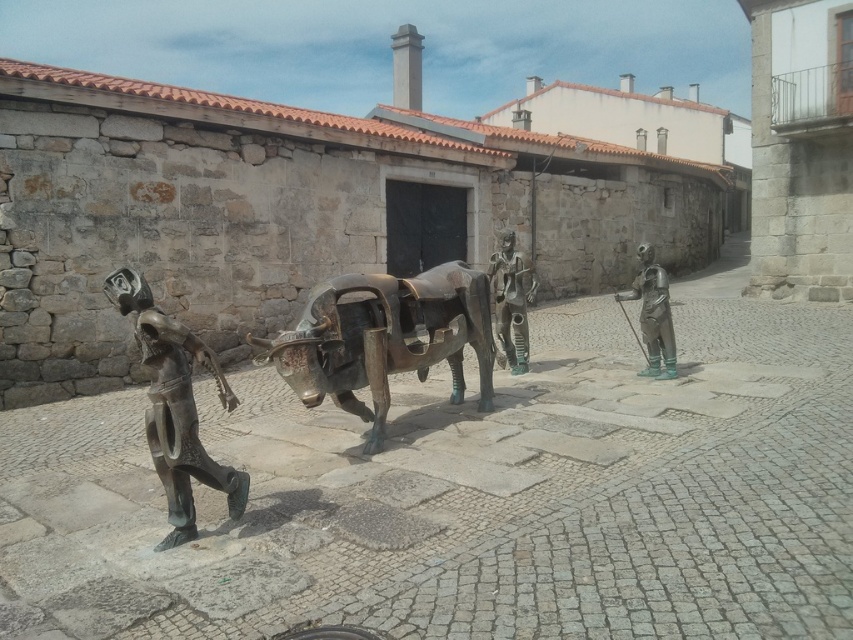
Which is more to the right, bronze statue at center or green patina statue at right?

From the viewer's perspective, green patina statue at right appears more on the right side.

Does bronze statue at center have a lesser width compared to green patina statue at right?

Incorrect, bronze statue at center's width is not less than green patina statue at right's.

The height and width of the screenshot is (640, 853). What do you see at coordinates (511, 301) in the screenshot? I see `bronze statue at center` at bounding box center [511, 301].

Identify the location of bronze statue at center. The image size is (853, 640). (511, 301).

Does bronze figure at left have a smaller size compared to bronze statue at center?

Actually, bronze figure at left might be larger than bronze statue at center.

Is point (233, 506) more distant than point (503, 348)?

No, (233, 506) is in front of (503, 348).

In order to click on bronze figure at left in this screenshot , I will do `click(175, 406)`.

Who is more forward, (238,492) or (666,378)?

Point (238,492) is in front.

Does bronze figure at left lie behind green patina statue at right?

No, bronze figure at left is in front of green patina statue at right.

Is point (131, 298) closer to viewer compared to point (643, 243)?

Yes, it is.

Locate an element on the screen. This screenshot has width=853, height=640. bronze figure at left is located at coordinates (175, 406).